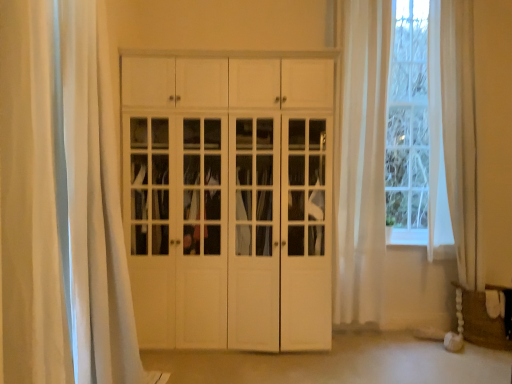
Image resolution: width=512 pixels, height=384 pixels. What do you see at coordinates (362, 163) in the screenshot?
I see `sheer white curtain at right, which ranks as the second curtain in front-to-back order` at bounding box center [362, 163].

The width and height of the screenshot is (512, 384). Find the location of `white matte cabinet at center`. white matte cabinet at center is located at coordinates (229, 201).

Find the location of a particular element. sheer white curtain at right, the second curtain when ordered from left to right is located at coordinates [x=362, y=163].

Is white sheer curtain at left, marked as the 1th curtain in a front-to-back arrangement, located outside brown woven basket at lower right?

Yes, white sheer curtain at left, marked as the 1th curtain in a front-to-back arrangement, is not within brown woven basket at lower right.

Does point (45, 209) appear closer or farther from the camera than point (475, 304)?

Point (45, 209) is positioned closer to the camera compared to point (475, 304).

Is white sheer curtain at left, the second curtain viewed from the back, looking in the opposite direction of brown woven basket at lower right?

No, white sheer curtain at left, the second curtain viewed from the back, is not facing away from brown woven basket at lower right.

Considering the relative positions of white sheer curtain at left, which appears as the second curtain when viewed from the right, and brown woven basket at lower right in the image provided, is white sheer curtain at left, which appears as the second curtain when viewed from the right, to the left of brown woven basket at lower right from the viewer's perspective?

Indeed, white sheer curtain at left, which appears as the second curtain when viewed from the right, is positioned on the left side of brown woven basket at lower right.

Could you tell me if white matte cabinet at center is facing brown woven basket at lower right?

No, white matte cabinet at center is not aimed at brown woven basket at lower right.

The width and height of the screenshot is (512, 384). I want to click on furniture lying below the white matte cabinet at center (from the image's perspective), so click(481, 321).

From a real-world perspective, is white matte cabinet at center located higher than brown woven basket at lower right?

Yes, from a real-world perspective, white matte cabinet at center is above brown woven basket at lower right.

Considering the relative sizes of white matte cabinet at center and brown woven basket at lower right in the image provided, is white matte cabinet at center thinner than brown woven basket at lower right?

Incorrect, the width of white matte cabinet at center is not less than that of brown woven basket at lower right.

From the image's perspective, which one is positioned lower, brown woven basket at lower right or white sheer curtain at left, which appears as the second curtain when viewed from the right?

brown woven basket at lower right, from the image's perspective.

In terms of size, does brown woven basket at lower right appear bigger or smaller than white sheer curtain at left, marked as the 1th curtain in a front-to-back arrangement?

brown woven basket at lower right is smaller than white sheer curtain at left, marked as the 1th curtain in a front-to-back arrangement.

This screenshot has width=512, height=384. In order to click on the 2nd curtain to the left when counting from the brown woven basket at lower right in this screenshot , I will do `click(30, 199)`.

Is brown woven basket at lower right oriented towards white sheer curtain at left, the second curtain viewed from the back?

No, brown woven basket at lower right is not facing towards white sheer curtain at left, the second curtain viewed from the back.

Considering the relative positions of sheer white curtain at right, which ranks as the first curtain in right-to-left order, and white sheer curtain at left, marked as the 1th curtain in a front-to-back arrangement, in the image provided, is sheer white curtain at right, which ranks as the first curtain in right-to-left order, to the left or to the right of white sheer curtain at left, marked as the 1th curtain in a front-to-back arrangement,?

From the image, it's evident that sheer white curtain at right, which ranks as the first curtain in right-to-left order, is to the right of white sheer curtain at left, marked as the 1th curtain in a front-to-back arrangement.

I want to click on curtain lying behind the white sheer curtain at left, marked as the 1th curtain in a front-to-back arrangement, so click(x=362, y=163).

Which point is more distant from viewer, (364, 213) or (35, 300)?

The point (364, 213) is behind.

Is sheer white curtain at right, which ranks as the first curtain in right-to-left order, wider than white sheer curtain at left, the second curtain viewed from the back?

Yes.

Considering the sizes of sheer white curtain at right, which ranks as the second curtain in front-to-back order, and brown woven basket at lower right in the image, is sheer white curtain at right, which ranks as the second curtain in front-to-back order, taller or shorter than brown woven basket at lower right?

In the image, sheer white curtain at right, which ranks as the second curtain in front-to-back order, appears to be taller than brown woven basket at lower right.

Between sheer white curtain at right, the second curtain when ordered from left to right, and brown woven basket at lower right, which one has smaller size?

brown woven basket at lower right.

Is the surface of sheer white curtain at right, which ranks as the second curtain in front-to-back order, in direct contact with brown woven basket at lower right?

sheer white curtain at right, which ranks as the second curtain in front-to-back order, is not next to brown woven basket at lower right, and they're not touching.

The image size is (512, 384). In order to click on furniture below the sheer white curtain at right, which appears as the first curtain when viewed from the back (from the image's perspective) in this screenshot , I will do `click(481, 321)`.

Is white sheer curtain at left, marked as the 1th curtain in a front-to-back arrangement, located within white matte cabinet at center?

Actually, white sheer curtain at left, marked as the 1th curtain in a front-to-back arrangement, is outside white matte cabinet at center.

Looking at this image, is white matte cabinet at center in front of or behind white sheer curtain at left, marked as the 1th curtain in a front-to-back arrangement, in the image?

white matte cabinet at center is behind white sheer curtain at left, marked as the 1th curtain in a front-to-back arrangement.

Could you tell me if white matte cabinet at center is turned towards white sheer curtain at left, the 1th curtain positioned from the left?

Yes.

Is white matte cabinet at center to the left or to the right of white sheer curtain at left, marked as the 1th curtain in a front-to-back arrangement, in the image?

From the image, it's evident that white matte cabinet at center is to the right of white sheer curtain at left, marked as the 1th curtain in a front-to-back arrangement.

Is white sheer curtain at left, marked as the 1th curtain in a front-to-back arrangement, positioned with its back to white matte cabinet at center?

No, white sheer curtain at left, marked as the 1th curtain in a front-to-back arrangement,'s orientation is not away from white matte cabinet at center.

Considering the sizes of objects white sheer curtain at left, the second curtain viewed from the back, and white matte cabinet at center in the image provided, who is bigger, white sheer curtain at left, the second curtain viewed from the back, or white matte cabinet at center?

Bigger between the two is white matte cabinet at center.

Are white sheer curtain at left, which appears as the second curtain when viewed from the right, and white matte cabinet at center located far from each other?

Yes, white sheer curtain at left, which appears as the second curtain when viewed from the right, and white matte cabinet at center are located far from each other.

Would you say white matte cabinet at center is part of white sheer curtain at left, which appears as the second curtain when viewed from the right,'s contents?

No, white matte cabinet at center is not a part of white sheer curtain at left, which appears as the second curtain when viewed from the right.

Find the location of a particular element. furniture below the white sheer curtain at left, marked as the 1th curtain in a front-to-back arrangement (from the image's perspective) is located at coordinates (481, 321).

This screenshot has width=512, height=384. I want to click on cupboard in front of the brown woven basket at lower right, so click(x=229, y=201).

From the image, which object appears to be farther from white sheer curtain at left, the second curtain viewed from the back, sheer white curtain at right, which ranks as the first curtain in right-to-left order, or brown woven basket at lower right?

brown woven basket at lower right.

Considering their positions, is white sheer curtain at left, the second curtain viewed from the back, positioned closer to sheer white curtain at right, which ranks as the first curtain in right-to-left order, than brown woven basket at lower right?

brown woven basket at lower right.

Based on their spatial positions, is white matte cabinet at center or brown woven basket at lower right further from sheer white curtain at right, which ranks as the second curtain in front-to-back order?

The object further to sheer white curtain at right, which ranks as the second curtain in front-to-back order, is brown woven basket at lower right.

Which object lies nearer to the anchor point brown woven basket at lower right, white matte cabinet at center or white sheer curtain at left, which appears as the second curtain when viewed from the right?

Based on the image, white matte cabinet at center appears to be nearer to brown woven basket at lower right.

When comparing their distances from brown woven basket at lower right, does sheer white curtain at right, which ranks as the first curtain in right-to-left order, or white matte cabinet at center seem further?

white matte cabinet at center lies further to brown woven basket at lower right than the other object.

Looking at the image, which one is located closer to white sheer curtain at left, the 1th curtain positioned from the left, white matte cabinet at center or sheer white curtain at right, the second curtain when ordered from left to right?

Among the two, white matte cabinet at center is located nearer to white sheer curtain at left, the 1th curtain positioned from the left.

From the image, which object appears to be nearer to brown woven basket at lower right, white sheer curtain at left, marked as the 1th curtain in a front-to-back arrangement, or white matte cabinet at center?

The object closer to brown woven basket at lower right is white matte cabinet at center.

Which object lies further to the anchor point white sheer curtain at left, marked as the 1th curtain in a front-to-back arrangement, white matte cabinet at center or brown woven basket at lower right?

The object further to white sheer curtain at left, marked as the 1th curtain in a front-to-back arrangement, is brown woven basket at lower right.

At what (x,y) coordinates should I click in order to perform the action: click on curtain located between white sheer curtain at left, which appears as the second curtain when viewed from the right, and brown woven basket at lower right in the left-right direction. Please return your answer as a coordinate pair (x, y). The height and width of the screenshot is (384, 512). Looking at the image, I should click on (362, 163).

The image size is (512, 384). Identify the location of cupboard between white sheer curtain at left, the 1th curtain positioned from the left, and brown woven basket at lower right, in the horizontal direction. (229, 201).

Where is `cupboard between white sheer curtain at left, marked as the 1th curtain in a front-to-back arrangement, and sheer white curtain at right, the second curtain when ordered from left to right, along the z-axis`? The width and height of the screenshot is (512, 384). cupboard between white sheer curtain at left, marked as the 1th curtain in a front-to-back arrangement, and sheer white curtain at right, the second curtain when ordered from left to right, along the z-axis is located at coordinates (229, 201).

Where is `curtain between white matte cabinet at center and brown woven basket at lower right`? curtain between white matte cabinet at center and brown woven basket at lower right is located at coordinates (362, 163).